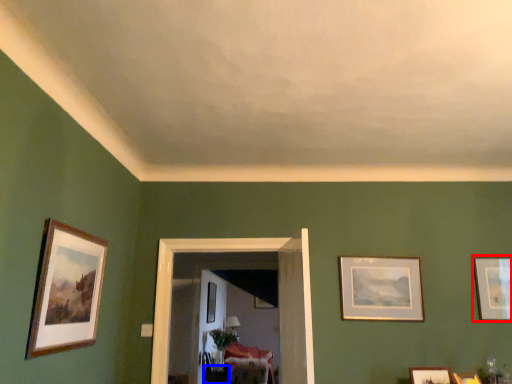
Question: Which of the following is the farthest to the observer, picture frame (highlighted by a red box) or table (highlighted by a blue box)?

Choices:
 (A) picture frame
 (B) table

Answer: (B)